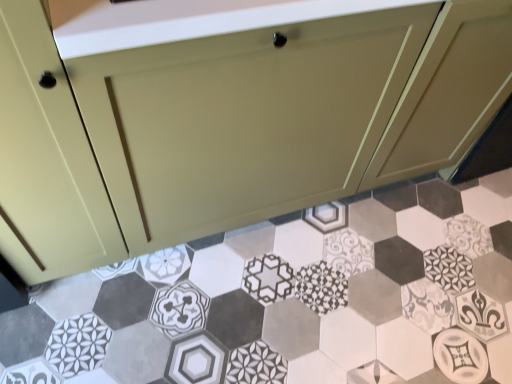
The width and height of the screenshot is (512, 384). Describe the element at coordinates (226, 114) in the screenshot. I see `matte cream cabinet at center` at that location.

At what (x,y) coordinates should I click in order to perform the action: click on matte cream cabinet at center. Please return your answer as a coordinate pair (x, y). Looking at the image, I should click on (226, 114).

What do you see at coordinates (290, 298) in the screenshot? I see `patterned ceramic hexagon at center` at bounding box center [290, 298].

The image size is (512, 384). Identify the location of patterned ceramic hexagon at center. (290, 298).

Measure the distance between patterned ceramic hexagon at center and camera.

The distance of patterned ceramic hexagon at center from camera is 1.21 meters.

The width and height of the screenshot is (512, 384). I want to click on matte cream cabinet at center, so point(226,114).

In the image, is patterned ceramic hexagon at center on the left side or the right side of matte cream cabinet at center?

From the image, it's evident that patterned ceramic hexagon at center is to the right of matte cream cabinet at center.

Looking at this image, considering the relative positions of patterned ceramic hexagon at center and matte cream cabinet at center in the image provided, is patterned ceramic hexagon at center behind matte cream cabinet at center?

Yes, patterned ceramic hexagon at center is behind matte cream cabinet at center.

Is point (246, 358) farther from viewer compared to point (212, 51)?

Yes, point (246, 358) is behind point (212, 51).

In the scene shown: From the image's perspective, which one is positioned lower, patterned ceramic hexagon at center or matte cream cabinet at center?

patterned ceramic hexagon at center, from the image's perspective.

From a real-world perspective, is patterned ceramic hexagon at center physically above matte cream cabinet at center?

No, from a real-world perspective, patterned ceramic hexagon at center is not on top of matte cream cabinet at center.

Between patterned ceramic hexagon at center and matte cream cabinet at center, which one has smaller width?

With smaller width is matte cream cabinet at center.

Between patterned ceramic hexagon at center and matte cream cabinet at center, which one has more height?

With more height is matte cream cabinet at center.

Is patterned ceramic hexagon at center bigger than matte cream cabinet at center?

Incorrect, patterned ceramic hexagon at center is not larger than matte cream cabinet at center.

Is patterned ceramic hexagon at center not within matte cream cabinet at center?

Yes.

Can you see patterned ceramic hexagon at center touching matte cream cabinet at center?

There is a gap between patterned ceramic hexagon at center and matte cream cabinet at center.

Is patterned ceramic hexagon at center oriented away from matte cream cabinet at center?

No, patterned ceramic hexagon at center is not facing the opposite direction of matte cream cabinet at center.

How different are the orientations of patterned ceramic hexagon at center and matte cream cabinet at center in degrees?

They differ by 0.787 degrees in their facing directions.

Where is `cabinetry located in front of the patterned ceramic hexagon at center`? The image size is (512, 384). cabinetry located in front of the patterned ceramic hexagon at center is located at coordinates (226, 114).

Which is more to the left, matte cream cabinet at center or patterned ceramic hexagon at center?

Positioned to the left is matte cream cabinet at center.

Does matte cream cabinet at center come behind patterned ceramic hexagon at center?

No, it is not.

Which is closer to the camera, (179, 107) or (501, 366)?

Point (179, 107) is positioned closer to the camera compared to point (501, 366).

From the image's perspective, is matte cream cabinet at center on patterned ceramic hexagon at center?

Indeed, from the image's perspective, matte cream cabinet at center is shown above patterned ceramic hexagon at center.

From a real-world perspective, is matte cream cabinet at center above or below patterned ceramic hexagon at center?

matte cream cabinet at center is above patterned ceramic hexagon at center.

Between matte cream cabinet at center and patterned ceramic hexagon at center, which one has smaller width?

Thinner between the two is matte cream cabinet at center.

In the scene shown: Who is taller, matte cream cabinet at center or patterned ceramic hexagon at center?

matte cream cabinet at center is taller.

Can you confirm if matte cream cabinet at center is smaller than patterned ceramic hexagon at center?

Incorrect, matte cream cabinet at center is not smaller in size than patterned ceramic hexagon at center.

Is matte cream cabinet at center located outside patterned ceramic hexagon at center?

matte cream cabinet at center is positioned outside patterned ceramic hexagon at center.

Is matte cream cabinet at center with patterned ceramic hexagon at center?

They are not placed beside each other.

Could you tell me if matte cream cabinet at center is turned towards patterned ceramic hexagon at center?

Yes, matte cream cabinet at center is aimed at patterned ceramic hexagon at center.

Measure the distance between matte cream cabinet at center and patterned ceramic hexagon at center.

The distance of matte cream cabinet at center from patterned ceramic hexagon at center is 18.99 inches.

Where is `cabinetry to the left of patterned ceramic hexagon at center`? cabinetry to the left of patterned ceramic hexagon at center is located at coordinates (226, 114).

The image size is (512, 384). I want to click on porcelain that appears below the matte cream cabinet at center (from a real-world perspective), so click(290, 298).

Identify the location of cabinetry positioned vertically above the patterned ceramic hexagon at center (from a real-world perspective). (226, 114).